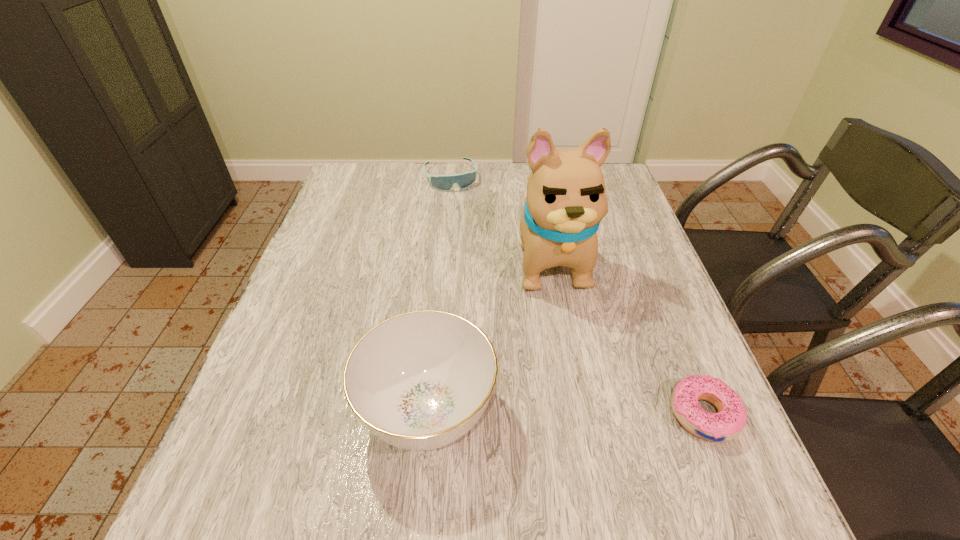
I want to click on free spot on the desktop that is between the second tallest object and the rightmost object and is positioned on the face of the puppy, so click(x=592, y=413).

This screenshot has height=540, width=960. I want to click on free space on the desktop that is between the third shortest object and the shortest object and is positioned on the front-facing side of the farthest object, so click(x=535, y=413).